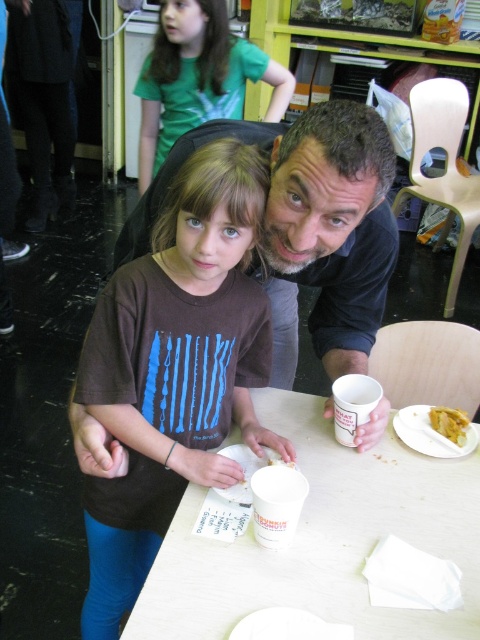
Which is in front, point (333, 300) or point (455, 416)?

Point (455, 416) is in front.

This screenshot has height=640, width=480. Describe the element at coordinates (309, 227) in the screenshot. I see `dark blue shirt at center` at that location.

The height and width of the screenshot is (640, 480). Describe the element at coordinates (309, 227) in the screenshot. I see `dark blue shirt at center` at that location.

Find the location of a particular element. dark blue shirt at center is located at coordinates (309, 227).

Is white paper plate at lower center taller than dark blue shirt at center?

In fact, white paper plate at lower center may be shorter than dark blue shirt at center.

Does point (167, 545) come closer to viewer compared to point (357, 113)?

That is False.

Identify the location of white paper plate at lower center. The width and height of the screenshot is (480, 640). (322, 540).

In the scene shown: Does white paper plate at lower center have a smaller size compared to yellow matte bread at lower right?

Incorrect, white paper plate at lower center is not smaller in size than yellow matte bread at lower right.

Is white paper plate at lower center to the left of yellow matte bread at lower right from the viewer's perspective?

Indeed, white paper plate at lower center is positioned on the left side of yellow matte bread at lower right.

Which is in front, point (372, 504) or point (464, 436)?

Positioned in front is point (372, 504).

The image size is (480, 640). Find the location of `white paper plate at lower center`. white paper plate at lower center is located at coordinates (322, 540).